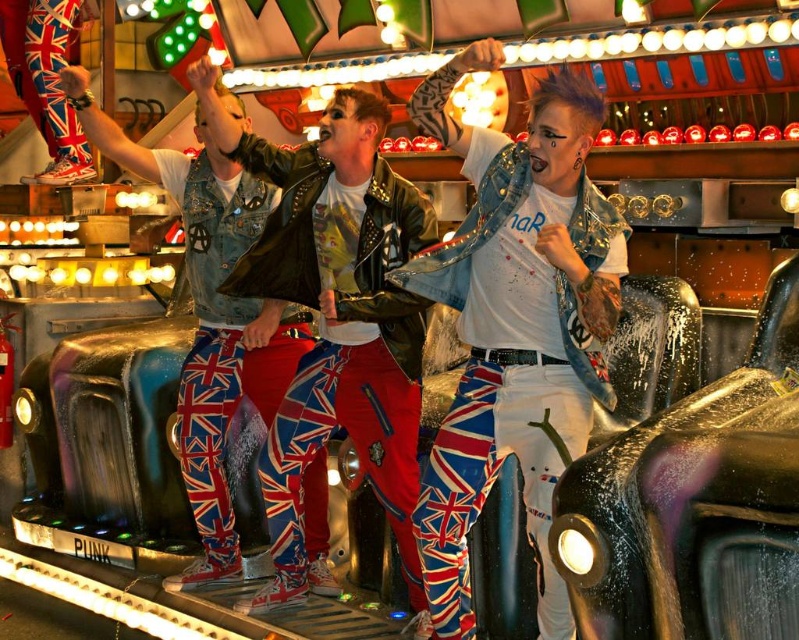
Does union jack pants at center have a smaller size compared to metallic purple car at right?

Indeed, union jack pants at center has a smaller size compared to metallic purple car at right.

Which is above, union jack pants at center or metallic purple car at right?

Positioned higher is metallic purple car at right.

Image resolution: width=799 pixels, height=640 pixels. Describe the element at coordinates (336, 316) in the screenshot. I see `union jack pants at center` at that location.

Where is `union jack pants at center`? union jack pants at center is located at coordinates (336, 316).